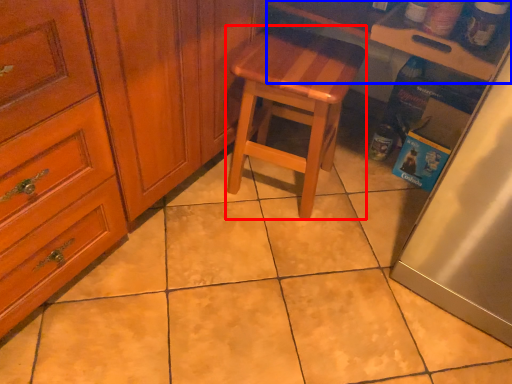
Question: Which point is closer to the camera, stool (highlighted by a red box) or counter top (highlighted by a blue box)?

Choices:
 (A) stool
 (B) counter top

Answer: (B)